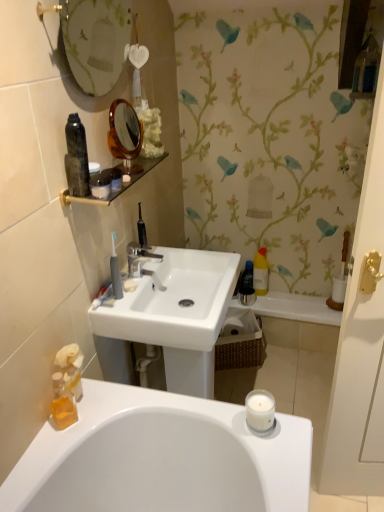
Where is `free space in front of yellow translucent bottle at right, positioned as the 2th bottle in bottom-to-top order`? This screenshot has height=512, width=384. free space in front of yellow translucent bottle at right, positioned as the 2th bottle in bottom-to-top order is located at coordinates tap(273, 303).